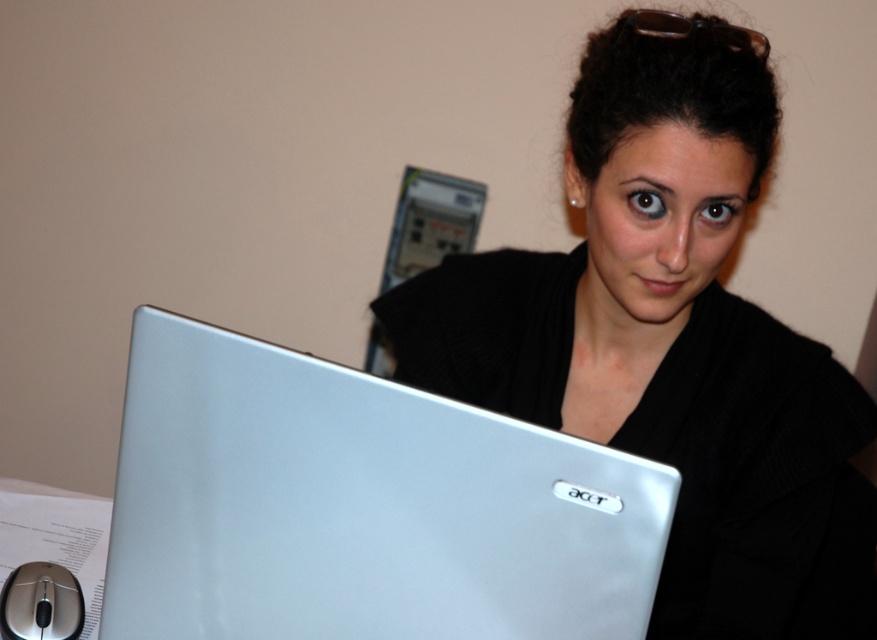
Question: Which of the following is the farthest from the observer?

Choices:
 (A) coord(526,378)
 (B) coord(346,604)

Answer: (A)

Question: Does matte silver laptop at center appear on the right side of silver metallic laptop at center?

Choices:
 (A) no
 (B) yes

Answer: (B)

Question: Does matte silver laptop at center have a greater width compared to silver metallic laptop at center?

Choices:
 (A) yes
 (B) no

Answer: (A)

Question: Which object is the farthest from the silver metallic mouse at lower left?

Choices:
 (A) matte silver laptop at center
 (B) silver metallic laptop at center

Answer: (A)

Question: Does silver metallic laptop at center have a larger size compared to silver metallic mouse at lower left?

Choices:
 (A) yes
 (B) no

Answer: (A)

Question: Estimate the real-world distances between objects in this image. Which object is farther from the matte silver laptop at center?

Choices:
 (A) silver metallic mouse at lower left
 (B) silver metallic laptop at center

Answer: (A)